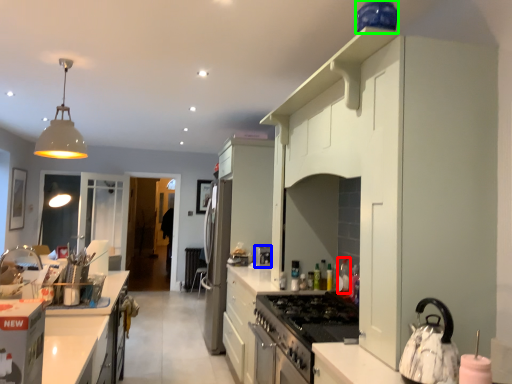
Question: Which object is the closest to the bottle (highlighted by a red box)? Choose among these: appliance (highlighted by a blue box) or appliance (highlighted by a green box).

Choices:
 (A) appliance
 (B) appliance

Answer: (A)